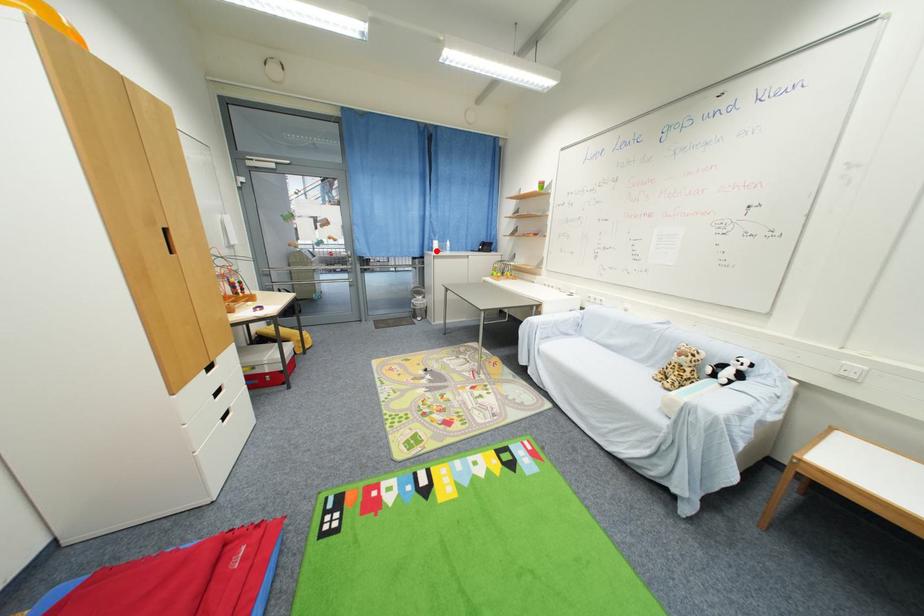
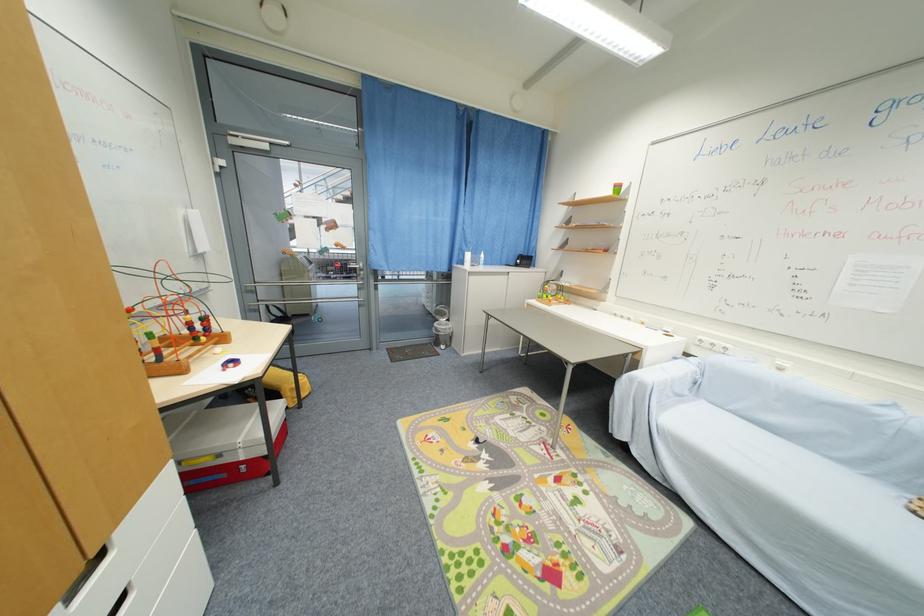
Locate, in the second image, the point that corresponds to the highlighted location in the first image.

(467, 264)